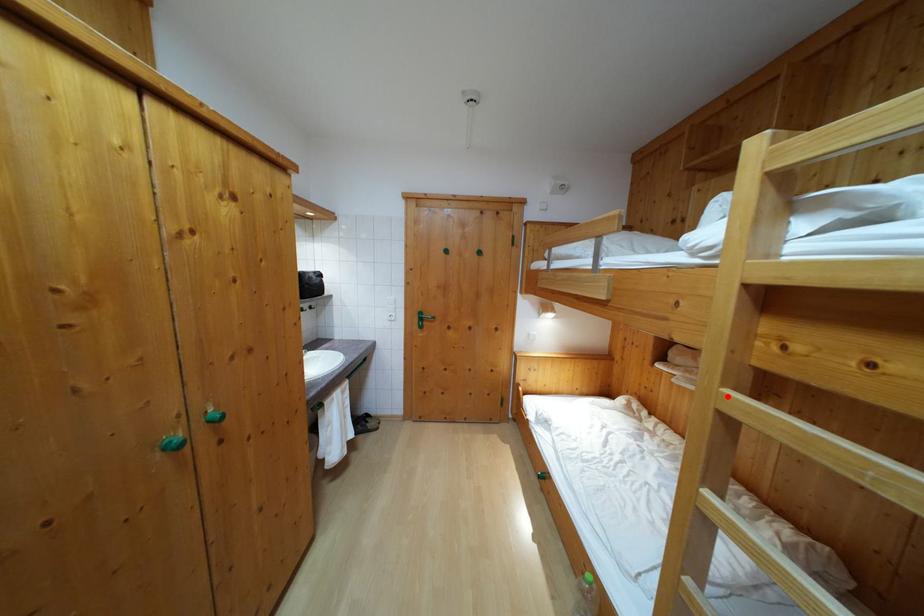
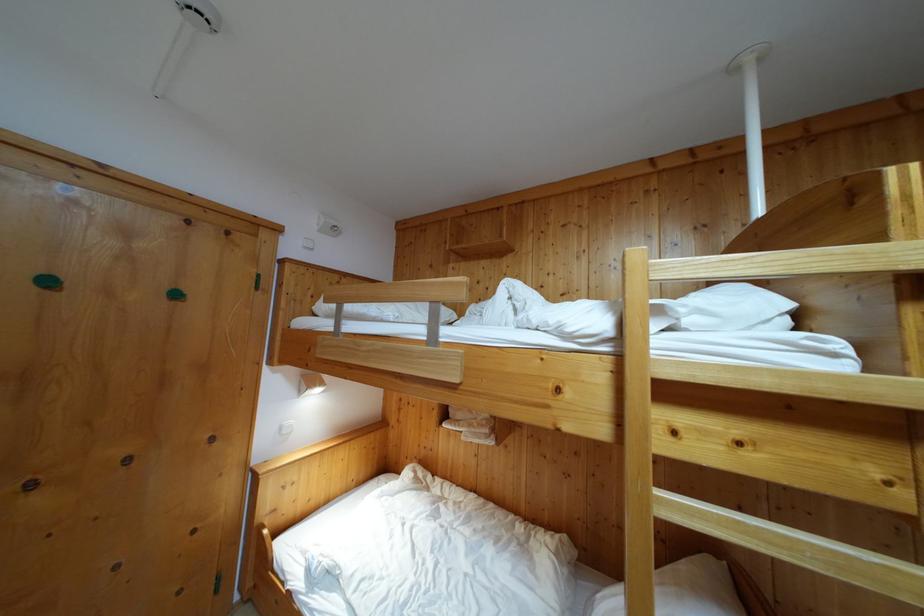
Find the pixel in the second image that matches the highlighted location in the first image.

(663, 500)